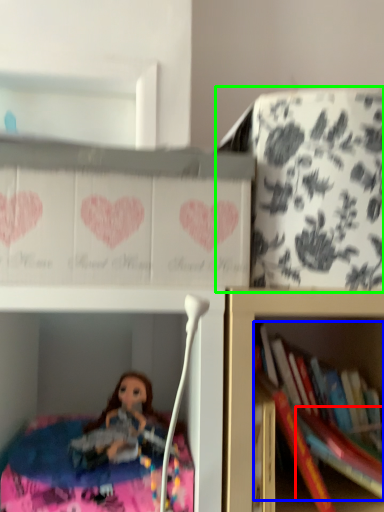
Question: Which object is the farthest from book (highlighted by a red box)? Choose among these: book (highlighted by a blue box) or cabinet (highlighted by a green box).

Choices:
 (A) book
 (B) cabinet

Answer: (B)